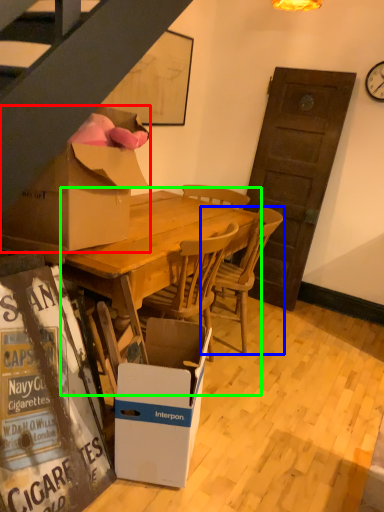
Question: Which is nearer to the box (highlighted by a red box)? chair (highlighted by a blue box) or round table (highlighted by a green box).

Choices:
 (A) chair
 (B) round table

Answer: (B)